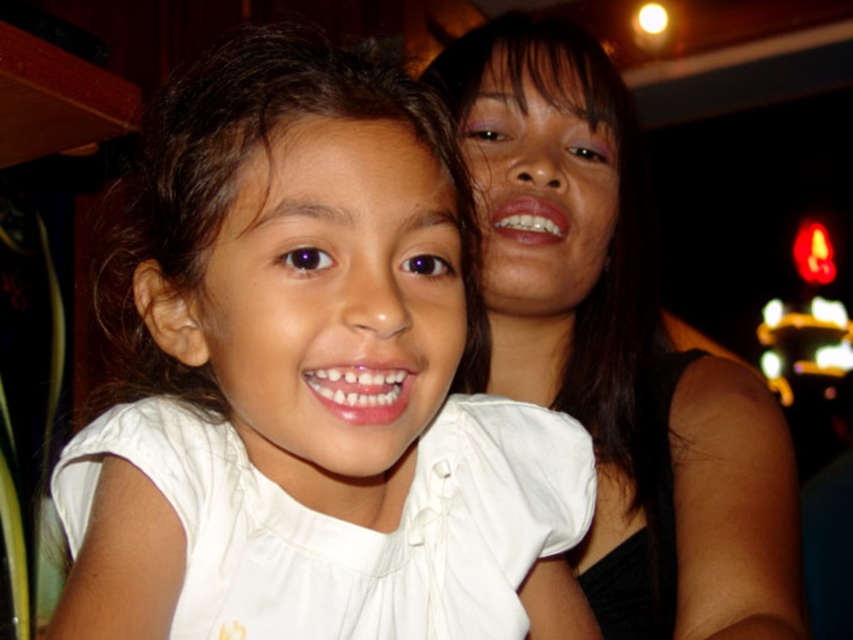
Question: Is white matte shirt at center below matte black hair at upper right?

Choices:
 (A) yes
 (B) no

Answer: (A)

Question: Can you confirm if white matte shirt at center is positioned below matte black hair at upper right?

Choices:
 (A) yes
 (B) no

Answer: (A)

Question: Among these objects, which one is nearest to the camera?

Choices:
 (A) matte black hair at upper right
 (B) white matte shirt at center

Answer: (B)

Question: Is white matte shirt at center wider than matte black hair at upper right?

Choices:
 (A) no
 (B) yes

Answer: (A)